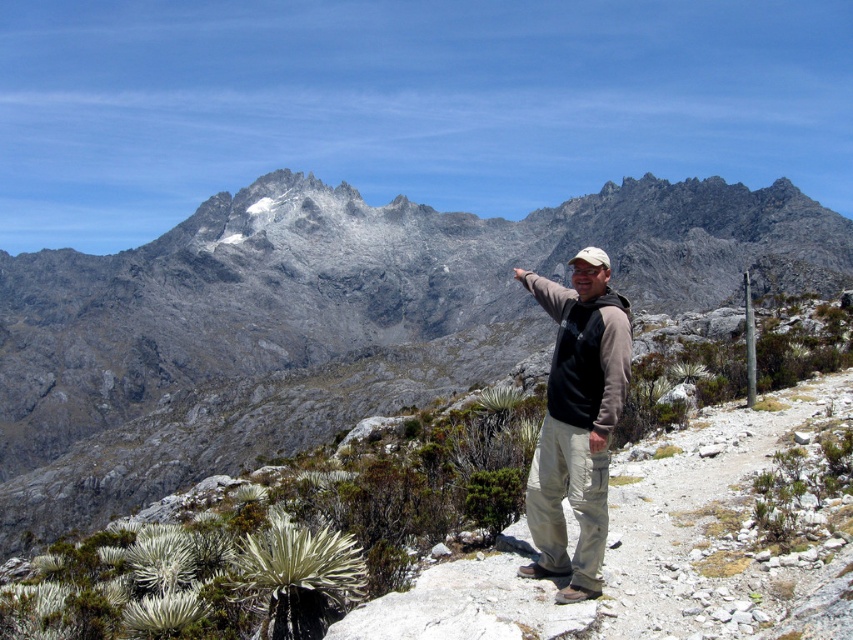
Question: Does gray rocky mountain at center have a greater width compared to brown cotton shirt at center?

Choices:
 (A) yes
 (B) no

Answer: (A)

Question: Among these objects, which one is farthest from the camera?

Choices:
 (A) gray rocky mountain at center
 (B) smooth dirt path at center
 (C) brown cotton shirt at center

Answer: (A)

Question: Which point is farther from the camera taking this photo?

Choices:
 (A) (740, 452)
 (B) (549, 429)

Answer: (A)

Question: Can you confirm if smooth dirt path at center is positioned below brown cotton shirt at center?

Choices:
 (A) no
 (B) yes

Answer: (B)

Question: Which point is farther from the camera taking this photo?

Choices:
 (A) (511, 349)
 (B) (822, 420)

Answer: (A)

Question: Is smooth dirt path at center behind brown cotton shirt at center?

Choices:
 (A) yes
 (B) no

Answer: (B)